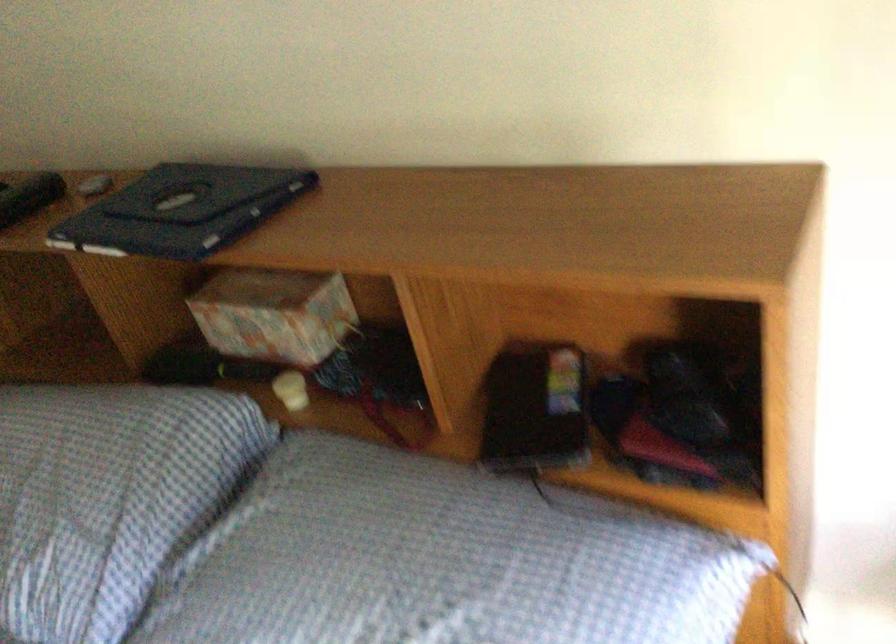
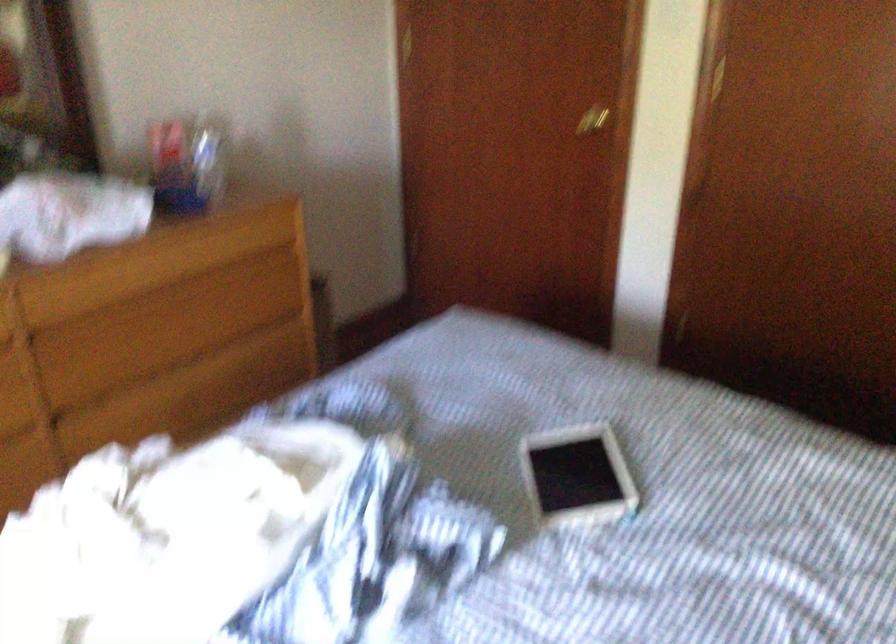
The first image is from the beginning of the video and the second image is from the end. How did the camera likely rotate when shooting the video?

The rotation direction of the camera is left-down.